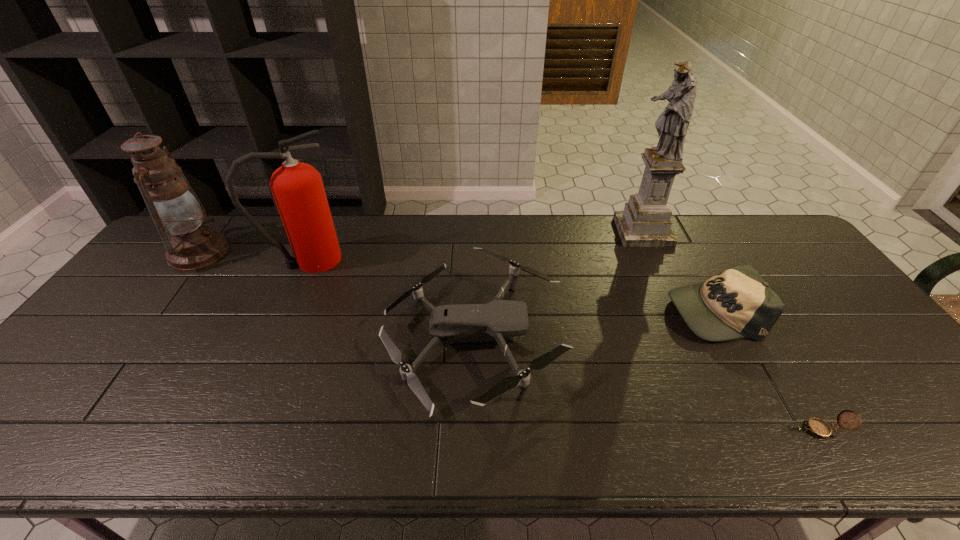
I want to click on vacant area situated on the right of the oil lamp, so click(x=250, y=253).

This screenshot has width=960, height=540. What are the coordinates of `free spot located 0.330m on the front-facing side of the third object from left to right` in the screenshot? It's located at (687, 339).

Find the location of a particular element. The height and width of the screenshot is (540, 960). free spot located 0.330m on the front-facing side of the baseball cap is located at coordinates (550, 312).

What are the coordinates of `vacant space situated 0.290m on the front-facing side of the baseball cap` in the screenshot? It's located at (564, 312).

Locate an element on the screen. The height and width of the screenshot is (540, 960). vacant space located 0.180m on the front-facing side of the baseball cap is located at coordinates (604, 312).

Image resolution: width=960 pixels, height=540 pixels. I want to click on vacant region located 0.380m on the face of the shortest object, so tap(624, 430).

The width and height of the screenshot is (960, 540). Identify the location of vacant space positioned 0.280m on the face of the shortest object. (670, 430).

Identify the location of vacant space located 0.100m on the face of the shortest object. (752, 430).

Identify the location of sculpture located in the far edge section of the desktop. Image resolution: width=960 pixels, height=540 pixels. (645, 222).

The width and height of the screenshot is (960, 540). Identify the location of fire extinguisher that is at the far edge. (298, 190).